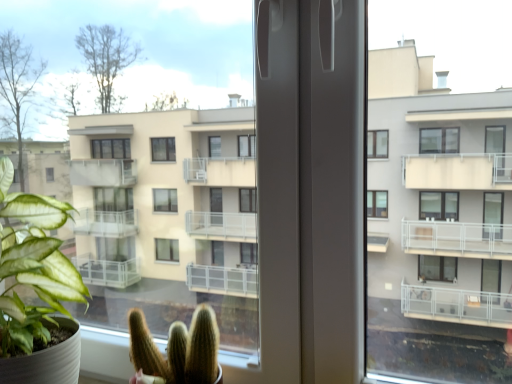
Question: From a real-world perspective, is green matte cactus at lower center, the 2th houseplant when ordered from left to right, positioned over green matte plant at left, arranged as the 1th houseplant when viewed from the left, based on gravity?

Choices:
 (A) no
 (B) yes

Answer: (A)

Question: Is green matte cactus at lower center, the 2th houseplant when ordered from left to right, oriented towards green matte plant at left, arranged as the second houseplant when viewed from the right?

Choices:
 (A) yes
 (B) no

Answer: (B)

Question: Are green matte cactus at lower center, the 2th houseplant when ordered from left to right, and green matte plant at left, arranged as the 1th houseplant when viewed from the left, making contact?

Choices:
 (A) no
 (B) yes

Answer: (A)

Question: Would you consider green matte cactus at lower center, acting as the 1th houseplant starting from the right, to be distant from green matte plant at left, arranged as the 1th houseplant when viewed from the left?

Choices:
 (A) yes
 (B) no

Answer: (B)

Question: Is green matte cactus at lower center, the 2th houseplant when ordered from left to right, bigger than green matte plant at left, arranged as the second houseplant when viewed from the right?

Choices:
 (A) no
 (B) yes

Answer: (A)

Question: Is green matte cactus at lower center, the 2th houseplant when ordered from left to right, to the right of green matte plant at left, arranged as the 1th houseplant when viewed from the left, from the viewer's perspective?

Choices:
 (A) no
 (B) yes

Answer: (B)

Question: Is green matte plant at left, arranged as the 1th houseplant when viewed from the left, thinner than green matte cactus at lower center, the 2th houseplant when ordered from left to right?

Choices:
 (A) no
 (B) yes

Answer: (A)

Question: Are green matte plant at left, arranged as the second houseplant when viewed from the right, and green matte cactus at lower center, the 2th houseplant when ordered from left to right, located far from each other?

Choices:
 (A) no
 (B) yes

Answer: (A)

Question: Is green matte plant at left, arranged as the 1th houseplant when viewed from the left, facing towards green matte cactus at lower center, acting as the 1th houseplant starting from the right?

Choices:
 (A) yes
 (B) no

Answer: (B)

Question: Considering the relative sizes of green matte plant at left, arranged as the second houseplant when viewed from the right, and green matte cactus at lower center, the 2th houseplant when ordered from left to right, in the image provided, is green matte plant at left, arranged as the second houseplant when viewed from the right, wider than green matte cactus at lower center, the 2th houseplant when ordered from left to right,?

Choices:
 (A) yes
 (B) no

Answer: (A)

Question: Is green matte plant at left, arranged as the 1th houseplant when viewed from the left, outside green matte cactus at lower center, the 2th houseplant when ordered from left to right?

Choices:
 (A) yes
 (B) no

Answer: (A)

Question: Is green matte plant at left, arranged as the 1th houseplant when viewed from the left, positioned behind green matte cactus at lower center, acting as the 1th houseplant starting from the right?

Choices:
 (A) no
 (B) yes

Answer: (A)

Question: From the image's perspective, is green matte cactus at lower center, acting as the 1th houseplant starting from the right, above or below green matte plant at left, arranged as the 1th houseplant when viewed from the left?

Choices:
 (A) below
 (B) above

Answer: (A)